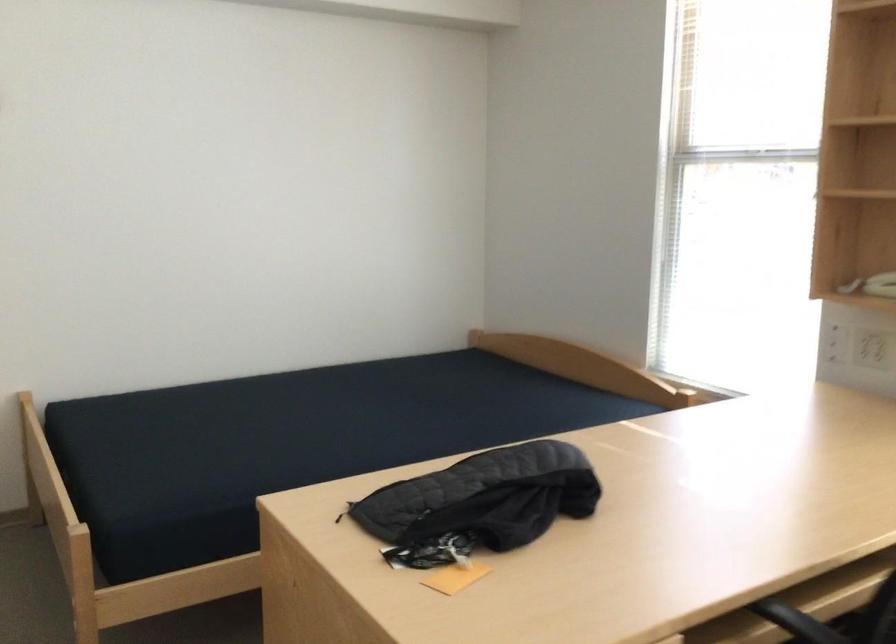
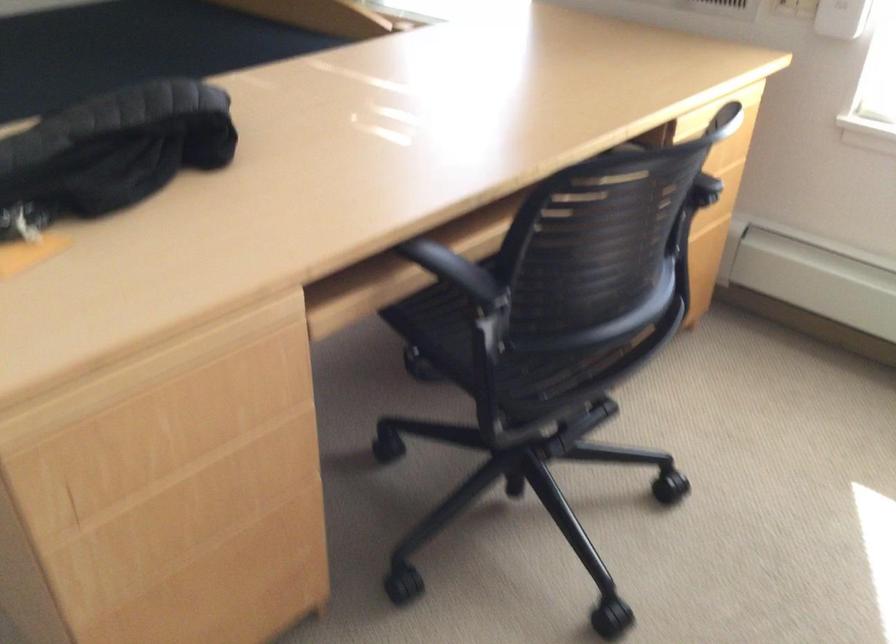
The images are taken continuously from a first-person perspective. In which direction are you moving?

The movement direction of the cameraman is right, forward.